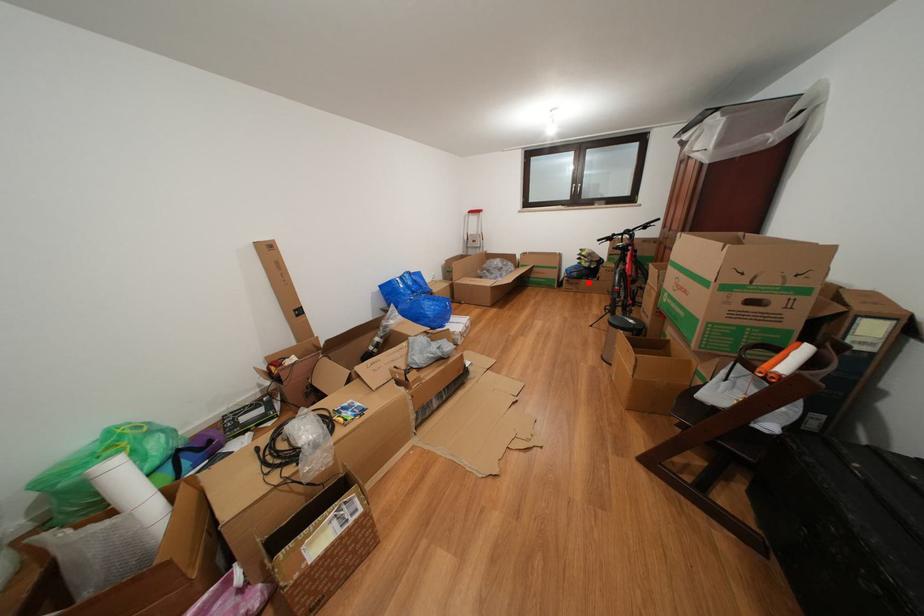
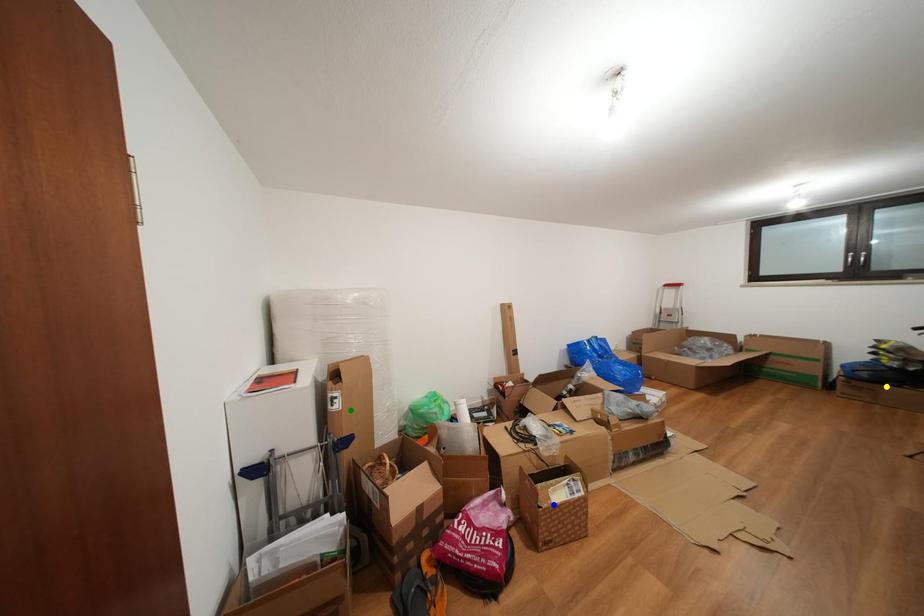
Question: I am providing you with two images of the same scene from different viewpoints. A red point is marked on the first image. You are given multiple points on the second image. Which point in image 2 represents the same 3d spot as the red point in image 1?

Choices:
 (A) green point
 (B) blue point
 (C) yellow point

Answer: (C)